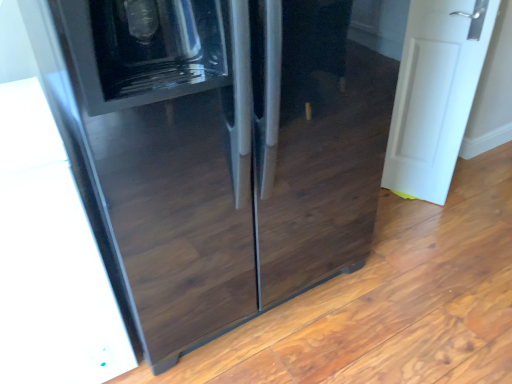
Identify the location of free space in front of white matte door at right. (424, 220).